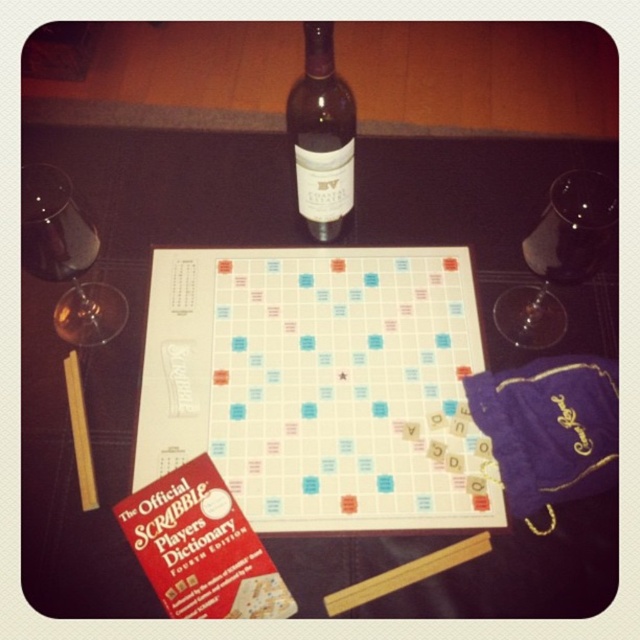
Which is in front, point (461, 538) or point (205, 278)?

Positioned in front is point (461, 538).

Can you confirm if white matte board game at center is positioned to the left of white plastic board at center?

Correct, you'll find white matte board game at center to the left of white plastic board at center.

This screenshot has height=640, width=640. I want to click on white matte board game at center, so (x=124, y=333).

Can you confirm if transparent glass at upper right is positioned below transparent glass at left?

Actually, transparent glass at upper right is above transparent glass at left.

Does point (550, 308) lie in front of point (26, 170)?

No, it is behind (26, 170).

At what (x,y) coordinates should I click in order to perform the action: click on transparent glass at upper right. Please return your answer as a coordinate pair (x, y). The height and width of the screenshot is (640, 640). Looking at the image, I should click on (557, 257).

The height and width of the screenshot is (640, 640). Describe the element at coordinates (124, 333) in the screenshot. I see `white matte board game at center` at that location.

Does white matte board game at center appear on the left side of dark brown glass bottle at upper center?

Indeed, white matte board game at center is positioned on the left side of dark brown glass bottle at upper center.

This screenshot has width=640, height=640. I want to click on white matte board game at center, so click(124, 333).